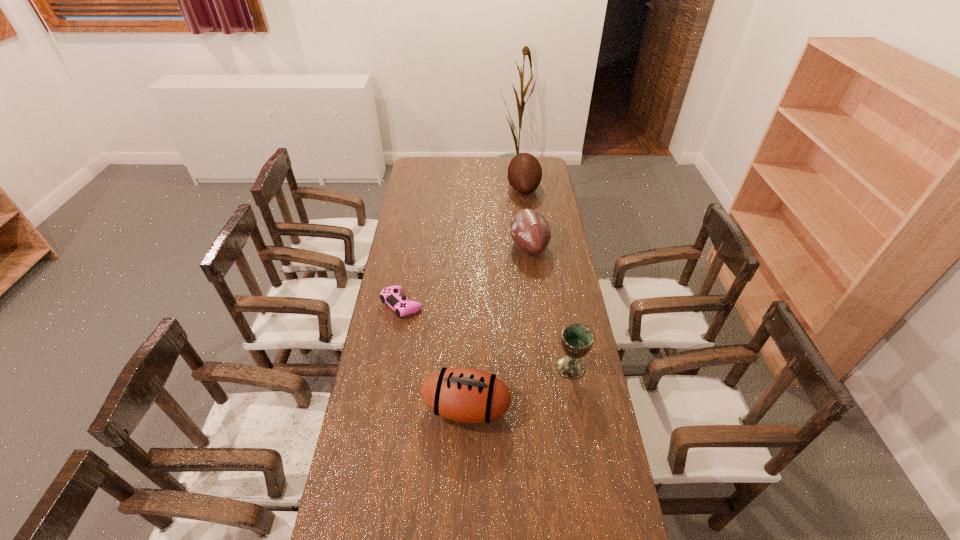
You are a GUI agent. You are given a task and a screenshot of the screen. Output one action in this format:
    pyautogui.click(x=<x>, y=<y>)
    Task: Click on the free space between the farthest football (American) and the third nearest object
    
    Given the screenshot: What is the action you would take?
    pyautogui.click(x=463, y=246)

Find the location of a particular element. This screenshot has width=960, height=540. the closest object relative to the shortest object is located at coordinates pyautogui.click(x=467, y=395).

Locate an element on the screen. The height and width of the screenshot is (540, 960). the third closest object to the nearest object is located at coordinates (530, 231).

At what (x,y) coordinates should I click in order to perform the action: click on the second closest football (American) to the second farthest football (American). Please return your answer as a coordinate pair (x, y). Looking at the image, I should click on (467, 395).

At what (x,y) coordinates should I click in order to perform the action: click on the third closest football (American) relative to the leftmost object. Please return your answer as a coordinate pair (x, y). Looking at the image, I should click on (524, 174).

You are a GUI agent. You are given a task and a screenshot of the screen. Output one action in this format:
    pyautogui.click(x=<x>, y=<y>)
    Task: Click on the vacant position in the image that satisfies the following two spatial constraints: 1. on the laces of the farthest football (American); 2. on the back side of the second nearest object
    The image size is (960, 540).
    Given the screenshot: What is the action you would take?
    pyautogui.click(x=546, y=367)

This screenshot has width=960, height=540. Identify the location of blank space that satisfies the following two spatial constraints: 1. on the laces of the farthest football (American); 2. on the right side of the fourth farthest object. (546, 367).

What are the coordinates of `vacant point that satisfies the following two spatial constraints: 1. on the back side of the second object from left to right; 2. on the right side of the fourth nearest object` in the screenshot? It's located at (470, 246).